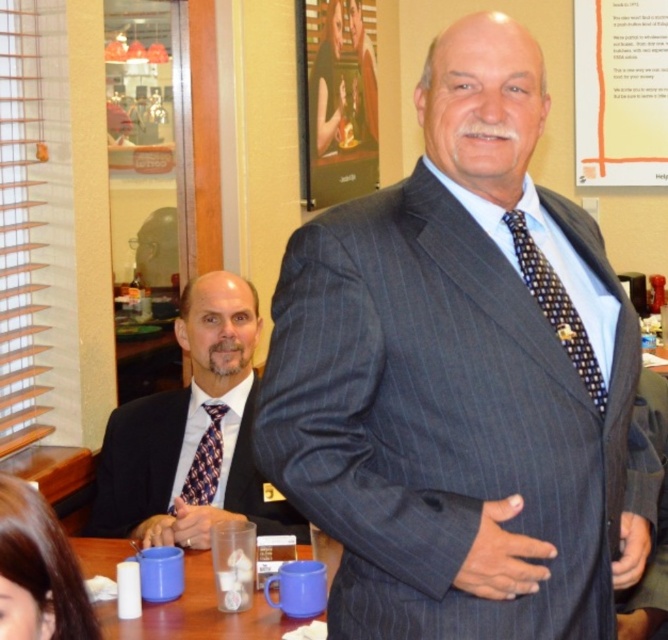
Question: Which of the following is the farthest from the observer?

Choices:
 (A) (194, 451)
 (B) (560, 305)
 (C) (234, 500)

Answer: (A)

Question: From the image, what is the correct spatial relationship of black silk suit at left in relation to matte plastic cups at lower center?

Choices:
 (A) left
 (B) right

Answer: (A)

Question: Which of the following is the farthest from the observer?

Choices:
 (A) plaid silk tie at center
 (B) pinstriped suit at center
 (C) matte plastic cups at lower center
 (D) black dotted tie at center

Answer: (A)

Question: Is black silk suit at left closer to camera compared to black dotted tie at center?

Choices:
 (A) no
 (B) yes

Answer: (A)

Question: Does pinstriped suit at center have a smaller size compared to black dotted tie at center?

Choices:
 (A) yes
 (B) no

Answer: (B)

Question: Which object is farther from the camera taking this photo?

Choices:
 (A) black silk suit at left
 (B) pinstriped suit at center

Answer: (A)